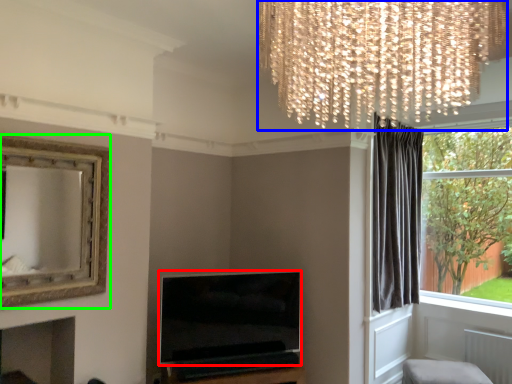
Question: Which is nearer to the television (highlighted by a red box)? lamp (highlighted by a blue box) or picture frame (highlighted by a green box).

Choices:
 (A) lamp
 (B) picture frame

Answer: (B)